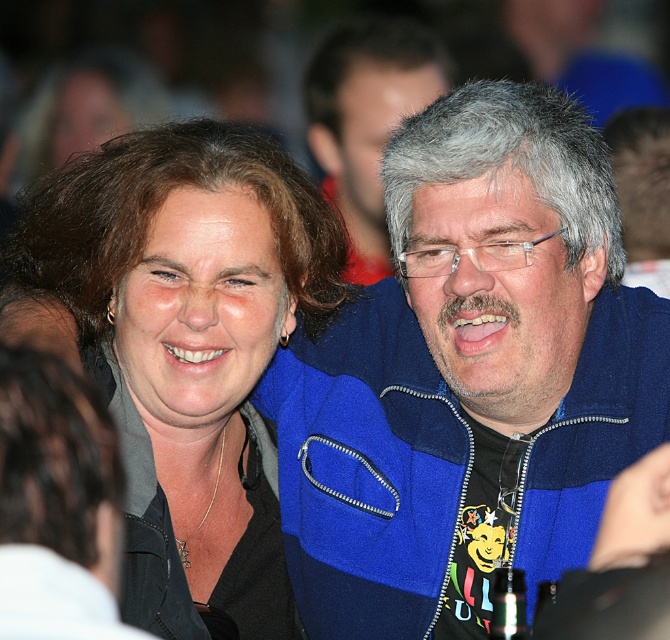
Question: Is blue fleece jacket at center wider than matte black jacket at center?

Choices:
 (A) no
 (B) yes

Answer: (B)

Question: In this image, where is blue fleece jacket at center located relative to blue fleece jacket at upper center?

Choices:
 (A) above
 (B) below

Answer: (B)

Question: Estimate the real-world distances between objects in this image. Which object is closer to the matte black jacket at center?

Choices:
 (A) blue fleece jacket at center
 (B) blue fleece jacket at upper center

Answer: (A)

Question: Which point is closer to the camera?

Choices:
 (A) blue fleece jacket at upper center
 (B) blue fleece jacket at center
 (C) matte black jacket at center

Answer: (C)

Question: Which point is farther from the camera taking this photo?

Choices:
 (A) (220, 316)
 (B) (411, 109)
 (C) (474, 125)

Answer: (B)

Question: Does blue fleece jacket at center lie behind blue fleece jacket at upper center?

Choices:
 (A) yes
 (B) no

Answer: (B)